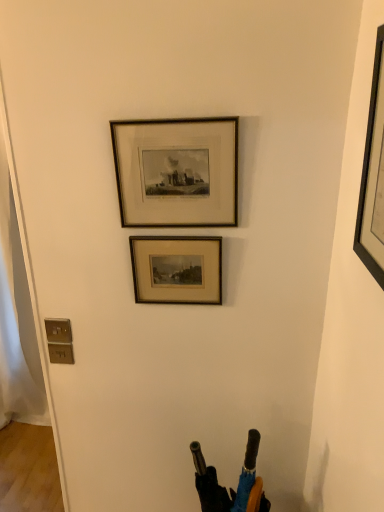
Question: From the image's perspective, is wooden framed print at center, positioned as the 3th picture frame in front-to-back order, on top of wooden frame at upper center, the second picture frame from the front?

Choices:
 (A) no
 (B) yes

Answer: (A)

Question: Can you confirm if wooden framed print at center, the first picture frame when ordered from back to front, is bigger than wooden frame at upper center, the second picture frame from the front?

Choices:
 (A) yes
 (B) no

Answer: (B)

Question: Is wooden framed print at center, the first picture frame when ordered from back to front, next to wooden frame at upper center, the second picture frame from the front?

Choices:
 (A) yes
 (B) no

Answer: (B)

Question: Is wooden framed print at center, the first picture frame when ordered from back to front, taller than wooden frame at upper center, the second picture frame from the front?

Choices:
 (A) yes
 (B) no

Answer: (B)

Question: Can we say wooden framed print at center, the first picture frame when ordered from back to front, lies outside wooden frame at upper center, the second picture frame from the front?

Choices:
 (A) yes
 (B) no

Answer: (A)

Question: Is black matte picture frame at upper right, the 3th picture frame when ordered from back to front, inside or outside of wooden framed print at center, positioned as the 3th picture frame in front-to-back order?

Choices:
 (A) outside
 (B) inside

Answer: (A)

Question: From a real-world perspective, is black matte picture frame at upper right, which appears as the 1th picture frame when viewed from the front, above or below wooden framed print at center, positioned as the 3th picture frame in front-to-back order?

Choices:
 (A) above
 (B) below

Answer: (A)

Question: Does point (375, 173) appear closer or farther from the camera than point (180, 266)?

Choices:
 (A) farther
 (B) closer

Answer: (B)

Question: Is black matte picture frame at upper right, which appears as the 1th picture frame when viewed from the front, taller or shorter than wooden framed print at center, the first picture frame when ordered from back to front?

Choices:
 (A) tall
 (B) short

Answer: (A)

Question: In terms of height, does wooden framed print at center, positioned as the 3th picture frame in front-to-back order, look taller or shorter compared to wooden frame at upper center, the second picture frame from the front?

Choices:
 (A) tall
 (B) short

Answer: (B)

Question: From a real-world perspective, is wooden framed print at center, the first picture frame when ordered from back to front, positioned above or below wooden frame at upper center, the second picture frame from the front?

Choices:
 (A) below
 (B) above

Answer: (A)

Question: Is point (173, 281) closer or farther from the camera than point (158, 123)?

Choices:
 (A) closer
 (B) farther

Answer: (B)

Question: From the image's perspective, is wooden framed print at center, the first picture frame when ordered from back to front, positioned above or below wooden frame at upper center, the second picture frame from the front?

Choices:
 (A) below
 (B) above

Answer: (A)

Question: Relative to wooden framed print at center, the first picture frame when ordered from back to front, is wooden frame at upper center, marked as the 2th picture frame in a back-to-front arrangement, in front or behind?

Choices:
 (A) front
 (B) behind

Answer: (A)

Question: Is point (211, 223) closer or farther from the camera than point (177, 268)?

Choices:
 (A) farther
 (B) closer

Answer: (B)